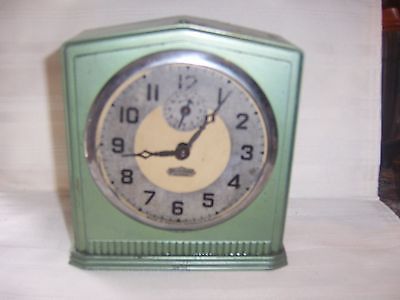
You are a GUI agent. You are given a task and a screenshot of the screen. Output one action in this format:
    pyautogui.click(x=<x>, y=<y>)
    Task: Click on the white surface
    This screenshot has width=400, height=300.
    Given the screenshot: What is the action you would take?
    pyautogui.click(x=12, y=256), pyautogui.click(x=340, y=246)